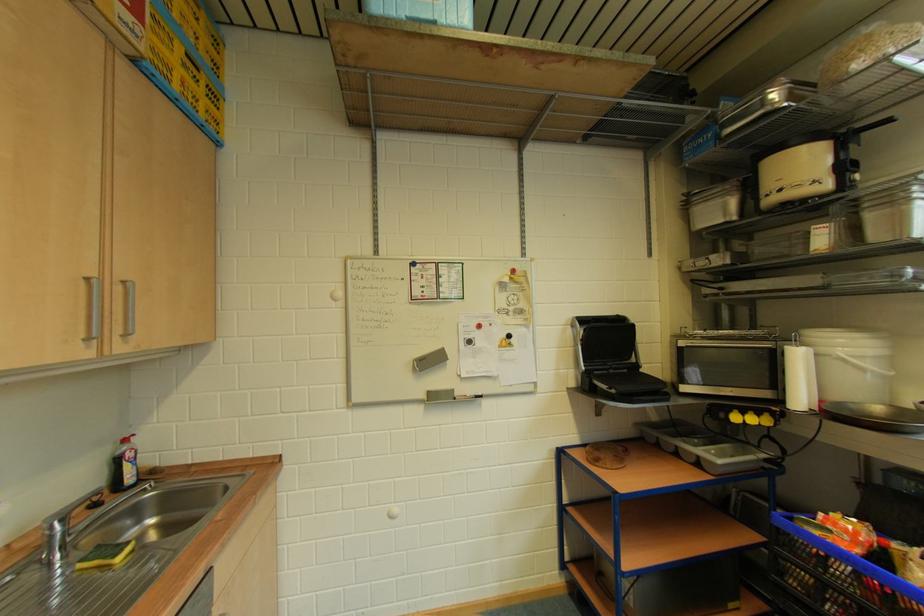
Where is `faucet handle`? faucet handle is located at coordinates (54, 543).